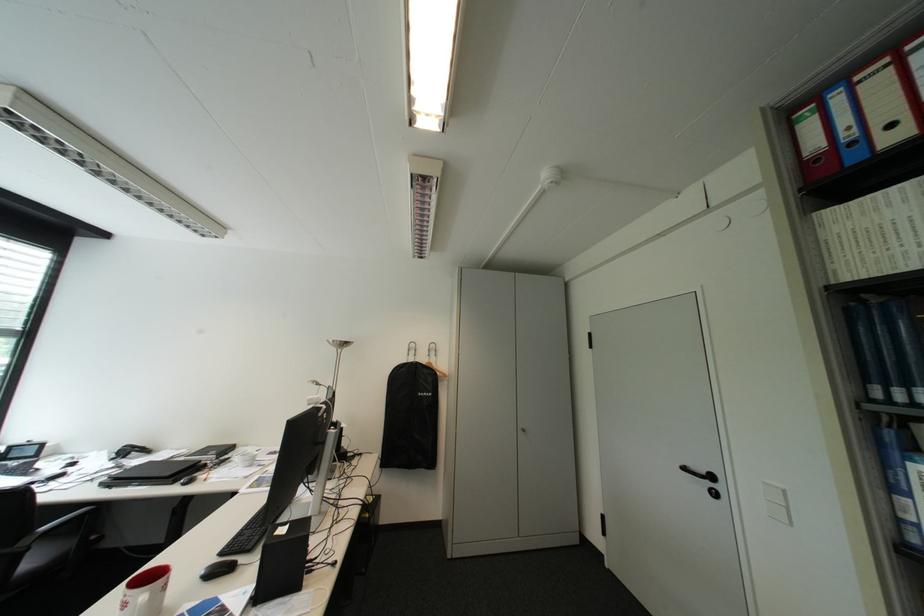
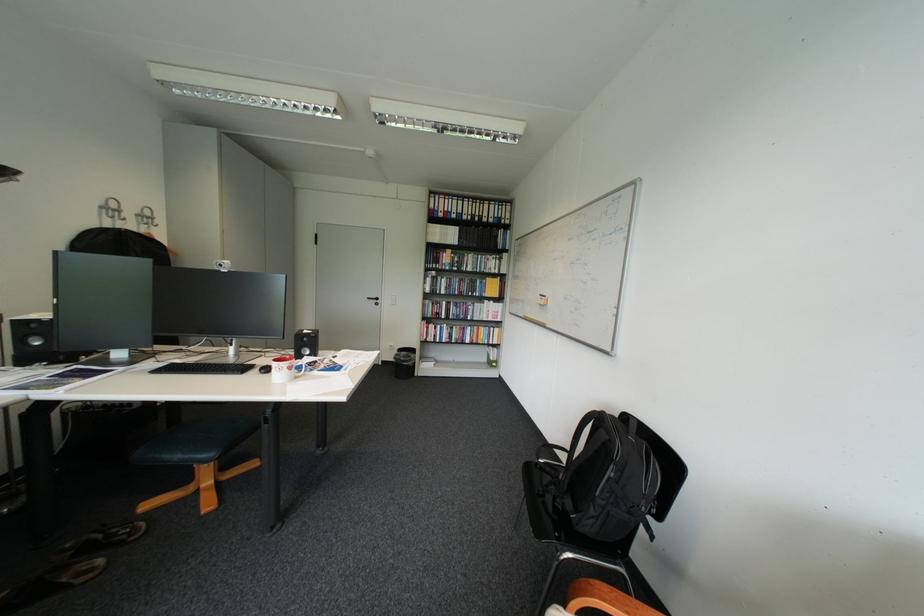
Find the pixel in the second image that matches (697,469) in the first image.

(381, 299)